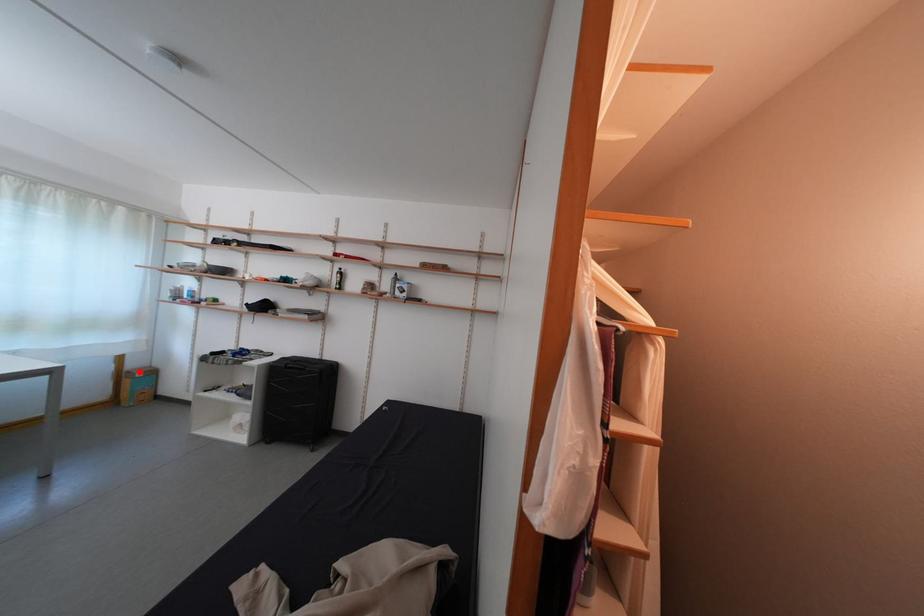
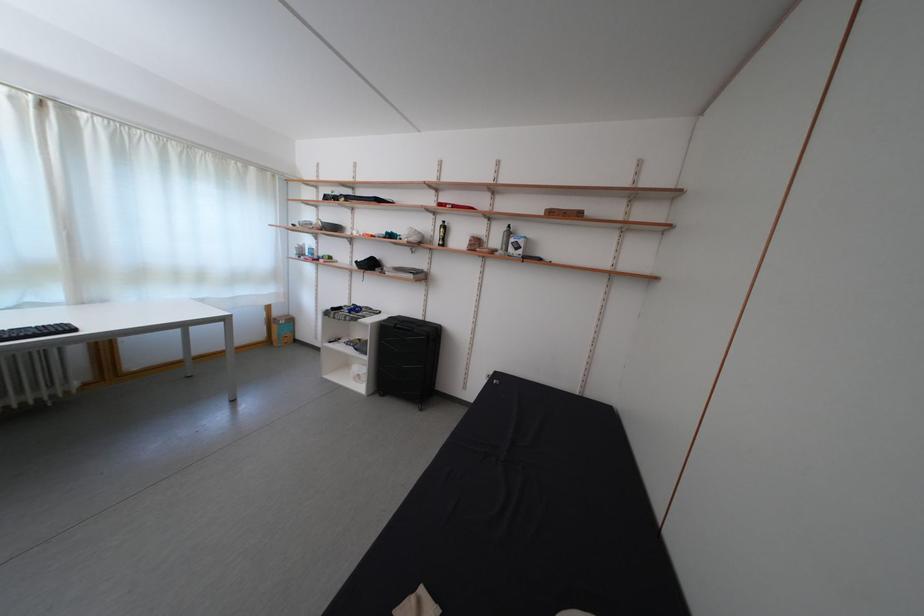
Question: A red point is marked in image1. In image2, is the corresponding 3D point closer to the camera or farther? Reply with the corresponding letter.

Choices:
 (A) The corresponding 3D point is closer.
 (B) The corresponding 3D point is farther.

Answer: (B)